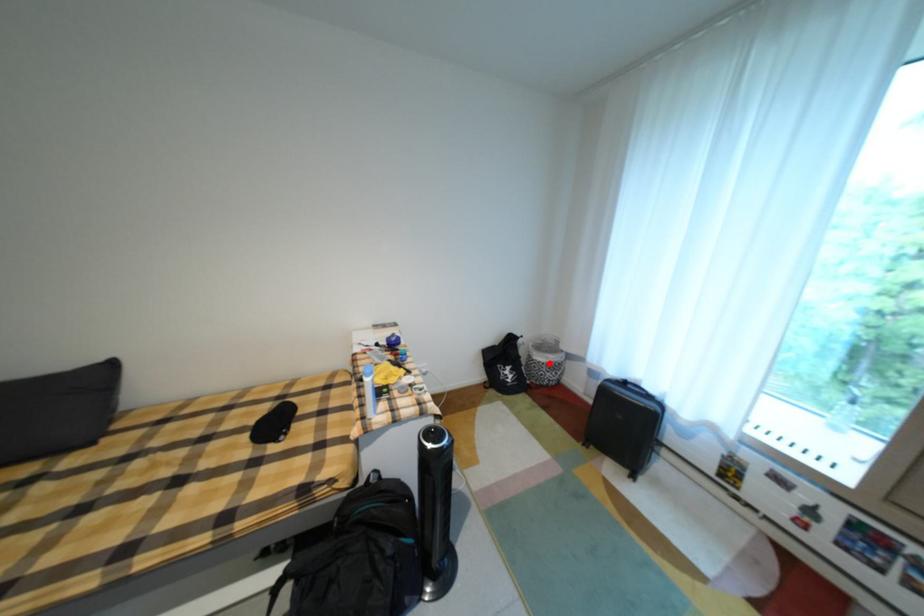
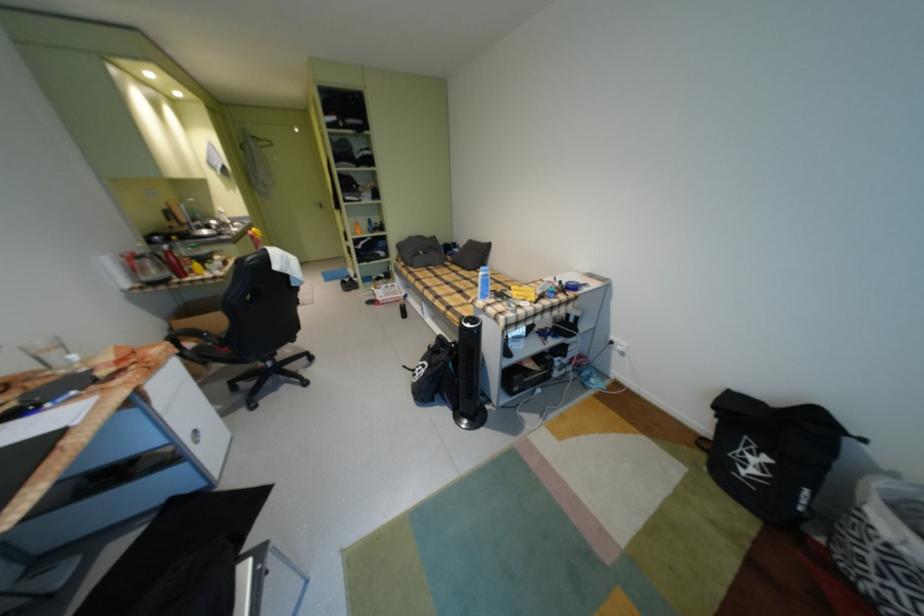
Question: A red point is marked in image1. In image2, is the corresponding 3D point closer to the camera or farther? Reply with the corresponding letter.

Choices:
 (A) The corresponding 3D point is closer.
 (B) The corresponding 3D point is farther.

Answer: (B)